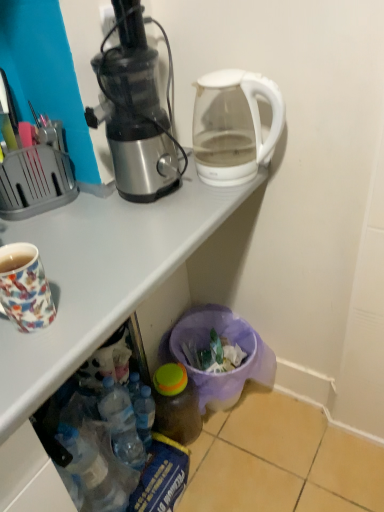
Locate an element on the screen. The width and height of the screenshot is (384, 512). vacant space to the right of multicolored ceramic mug at left is located at coordinates (105, 295).